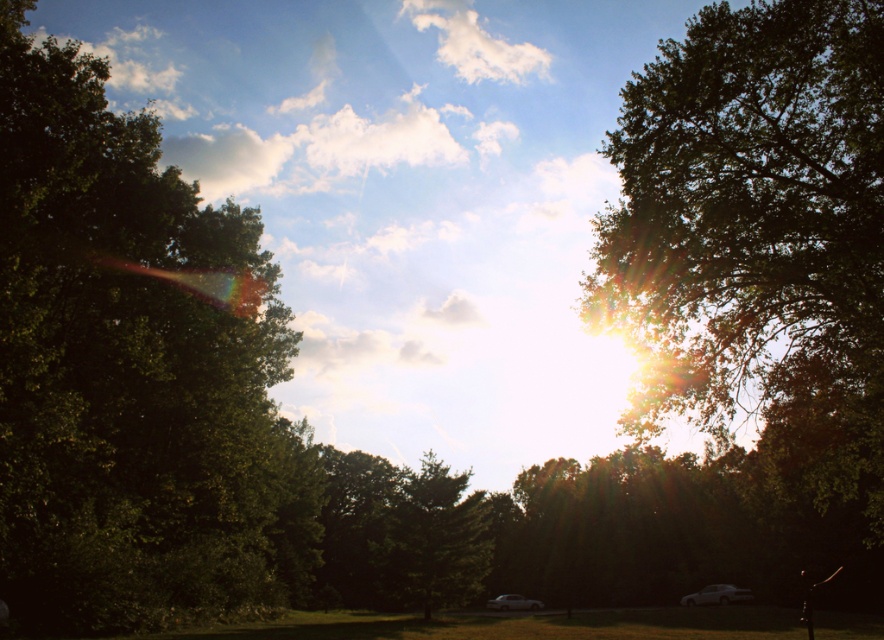
From the picture: Does green leafy tree at left have a larger size compared to green matte tree at center?

Yes, green leafy tree at left is bigger than green matte tree at center.

Between green leafy tree at left and green matte tree at center, which one has more height?

Standing taller between the two is green leafy tree at left.

Where is `green leafy tree at left`? green leafy tree at left is located at coordinates (133, 371).

Consider the image. Who is more distant from viewer, (816, 422) or (450, 540)?

Positioned behind is point (450, 540).

Is green leafy tree at upper right closer to the viewer compared to green matte tree at center?

Yes.

Locate an element on the screen. This screenshot has height=640, width=884. green leafy tree at upper right is located at coordinates (761, 259).

I want to click on green leafy tree at upper right, so click(761, 259).

Based on the photo, does green leafy tree at left lie in front of green leafy tree at upper right?

A: No.

Who is positioned more to the right, green leafy tree at left or green leafy tree at upper right?

Positioned to the right is green leafy tree at upper right.

Who is more forward, [222,611] or [858,115]?

Point [858,115]

This screenshot has height=640, width=884. In order to click on green leafy tree at left in this screenshot , I will do `click(133, 371)`.